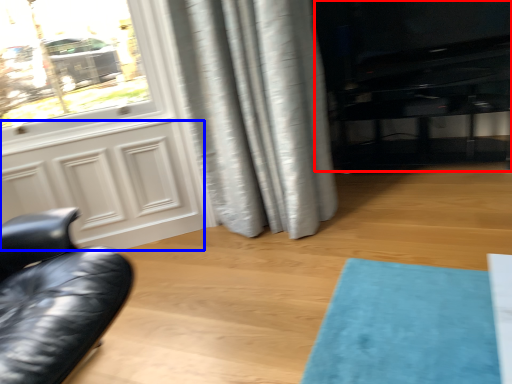
Question: Which point is closer to the camera, entertainment center (highlighted by a red box) or screen door (highlighted by a blue box)?

Choices:
 (A) entertainment center
 (B) screen door

Answer: (B)